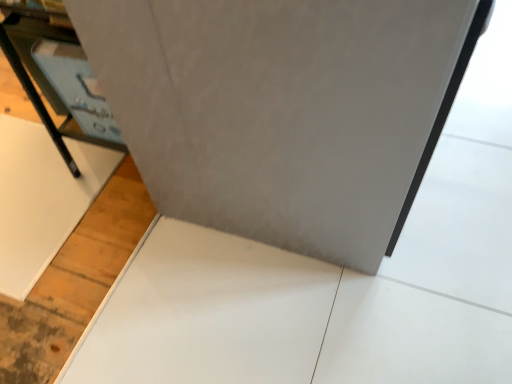
The width and height of the screenshot is (512, 384). I want to click on white glossy table at lower left, so click(57, 74).

This screenshot has height=384, width=512. Describe the element at coordinates (57, 74) in the screenshot. I see `white glossy table at lower left` at that location.

Image resolution: width=512 pixels, height=384 pixels. Find the location of `white glossy table at lower left`. white glossy table at lower left is located at coordinates (57, 74).